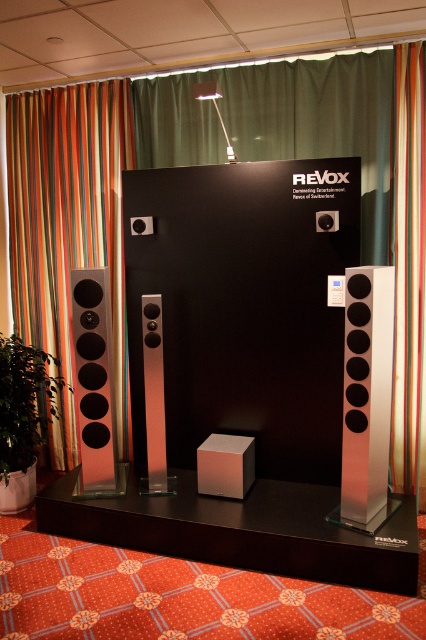
Question: Is green fabric curtain at upper center below satin silver speaker at center?

Choices:
 (A) no
 (B) yes

Answer: (A)

Question: Can you confirm if green fabric curtain at upper center is smaller than striped fabric at left?

Choices:
 (A) no
 (B) yes

Answer: (B)

Question: Which object appears farthest from the camera in this image?

Choices:
 (A) satin silver speaker at left
 (B) striped fabric at left

Answer: (B)

Question: Which point is closer to the camera?

Choices:
 (A) satin silver speaker at center
 (B) striped fabric at left

Answer: (A)

Question: Does striped fabric curtain at upper center lie in front of satin silver speaker at center?

Choices:
 (A) no
 (B) yes

Answer: (A)

Question: Which object appears closest to the camera in this image?

Choices:
 (A) satin silver speaker at center
 (B) striped fabric curtain at upper center
 (C) green fabric curtain at upper center

Answer: (A)